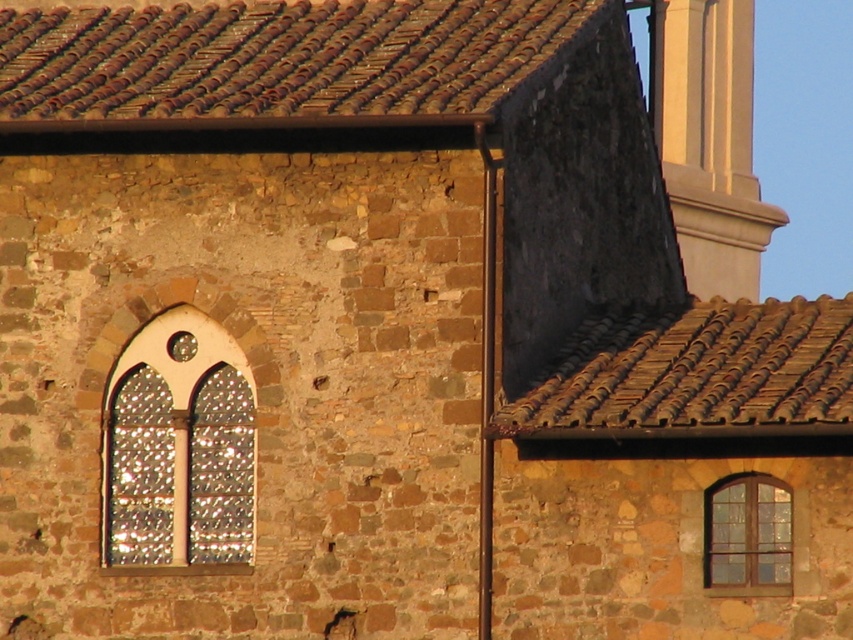
Between point (460, 102) and point (776, 513), which one is positioned in front?

Point (776, 513) is more forward.

Does point (538, 56) come behind point (746, 540)?

Yes, it is behind point (746, 540).

The height and width of the screenshot is (640, 853). Find the location of `brown clay tiles at upper left`. brown clay tiles at upper left is located at coordinates (273, 58).

Does point (186, 8) lie in front of point (769, 372)?

No, (186, 8) is further to viewer.

This screenshot has width=853, height=640. What do you see at coordinates (273, 58) in the screenshot? I see `brown clay tiles at upper left` at bounding box center [273, 58].

Where is `brown clay tiles at upper left`? brown clay tiles at upper left is located at coordinates (273, 58).

What do you see at coordinates (695, 372) in the screenshot? This screenshot has height=640, width=853. I see `brown tile roof at upper right` at bounding box center [695, 372].

Which is in front, point (756, 426) or point (228, 516)?

Point (756, 426)

Find the location of `brown tile roof at upper right`. brown tile roof at upper right is located at coordinates (695, 372).